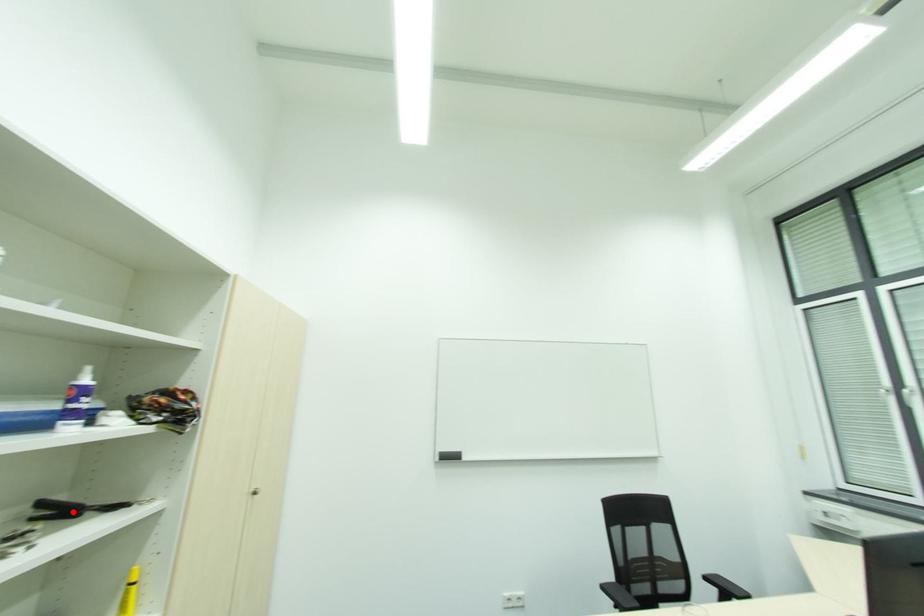
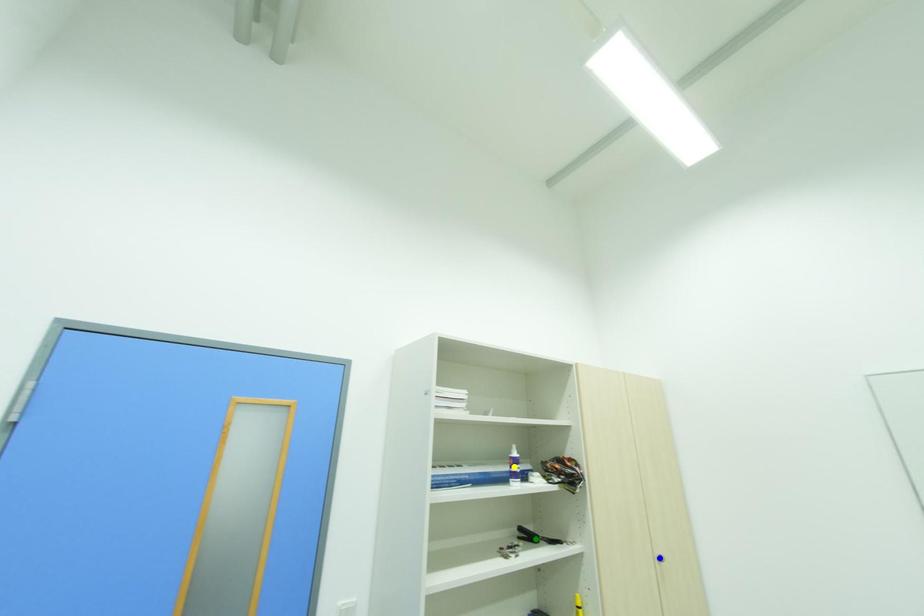
Question: I am providing you with two images of the same scene from different viewpoints. A red point is marked on the first image. You are given multiple points on the second image. Which point in image 2 is actually the same real-world point as the red point in image 1?

Choices:
 (A) blue point
 (B) yellow point
 (C) green point

Answer: (C)